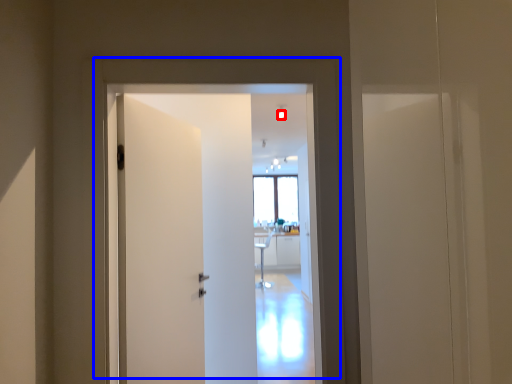
Question: Which point is closer to the camera, light (highlighted by a red box) or door (highlighted by a blue box)?

Choices:
 (A) light
 (B) door

Answer: (B)